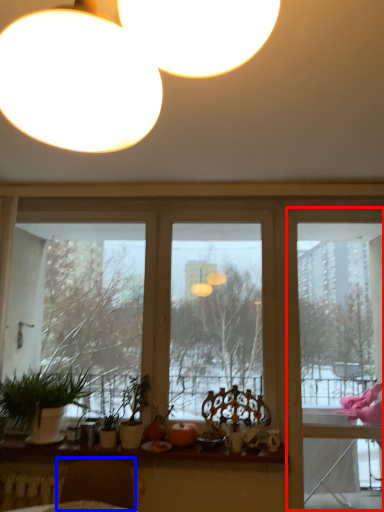
Question: Which object is closer to the camera taking this photo, screen door (highlighted by a red box) or swivel chair (highlighted by a blue box)?

Choices:
 (A) screen door
 (B) swivel chair

Answer: (B)